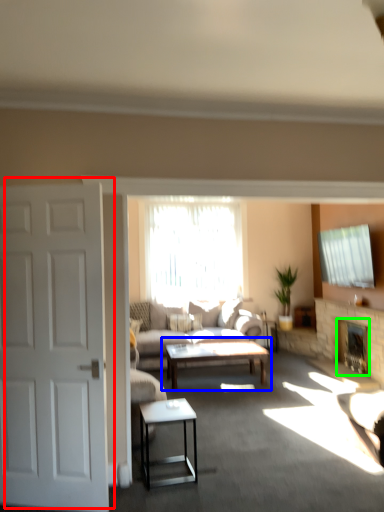
Question: Which object is positioned closest to door (highlighted by a red box)? Select from coffee table (highlighted by a blue box) and fireplace (highlighted by a green box).

Choices:
 (A) coffee table
 (B) fireplace

Answer: (A)